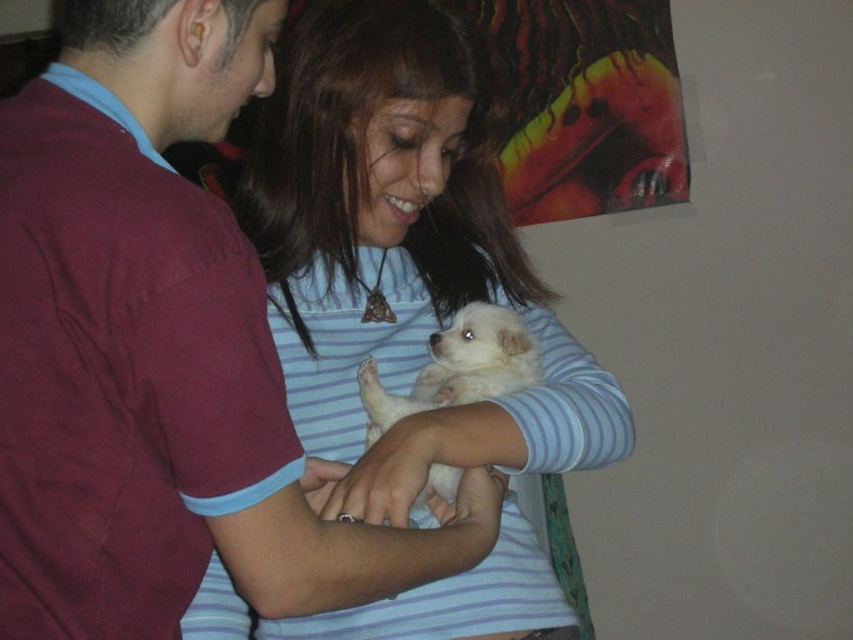
You are a photographer trying to capture the perfect shot of the scene. You notice the white soft fur at center and the white fluffy dog at center. Which object should you focus on if you want to emphasize something bigger in the frame?

The white soft fur at center has a larger size compared to the white fluffy dog at center, so you should focus on the white soft fur at center to emphasize the bigger object in the frame.

You are a photographer trying to capture the interaction between the two people and the dog. You notice the white soft fur at center and the white fluffy dog at center. Which object is closer to the camera?

The white soft fur at center is in front of the white fluffy dog at center, so it is closer to the camera.